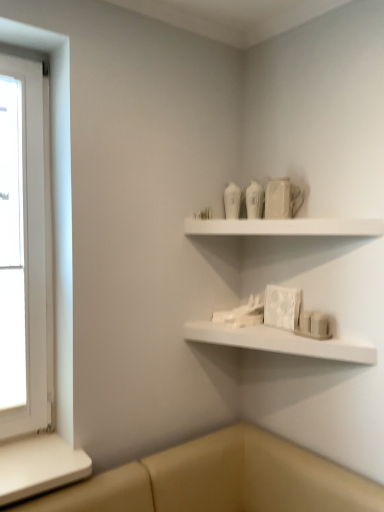
Measure the distance between white wooden window at left and camera.

white wooden window at left and camera are 1.50 meters apart from each other.

Identify the location of white matte shelf at upper center, the second shelf when ordered from bottom to top. This screenshot has height=512, width=384. (284, 227).

Based on the photo, from a real-world perspective, is white matte shelf at upper center, which ranks as the first shelf in top-to-bottom order, beneath white matte shelf at lower center, which is the 1th shelf in bottom-to-top order?

No, from a real-world perspective, white matte shelf at upper center, which ranks as the first shelf in top-to-bottom order, is not under white matte shelf at lower center, which is the 1th shelf in bottom-to-top order.

From the image's perspective, is white matte shelf at upper center, the second shelf when ordered from bottom to top, above or below white matte shelf at lower center, the 2th shelf viewed from the top?

white matte shelf at upper center, the second shelf when ordered from bottom to top, is situated higher than white matte shelf at lower center, the 2th shelf viewed from the top, in the image.

In the scene shown: Is white matte shelf at upper center, the second shelf when ordered from bottom to top, taller or shorter than white matte shelf at lower center, which is the 1th shelf in bottom-to-top order?

Considering their sizes, white matte shelf at upper center, the second shelf when ordered from bottom to top, has more height than white matte shelf at lower center, which is the 1th shelf in bottom-to-top order.

Can you tell me how much white matte shelf at lower center, which is the 1th shelf in bottom-to-top order, and white matte shelf at upper center, which ranks as the first shelf in top-to-bottom order, differ in facing direction?

The angle between the facing direction of white matte shelf at lower center, which is the 1th shelf in bottom-to-top order, and the facing direction of white matte shelf at upper center, which ranks as the first shelf in top-to-bottom order, is 1.91 degrees.

Relative to white matte shelf at upper center, which ranks as the first shelf in top-to-bottom order, is white matte shelf at lower center, which is the 1th shelf in bottom-to-top order, in front or behind?

white matte shelf at lower center, which is the 1th shelf in bottom-to-top order, is positioned farther from the viewer than white matte shelf at upper center, which ranks as the first shelf in top-to-bottom order.

Is white matte shelf at lower center, the 2th shelf viewed from the top, not near white matte shelf at upper center, which ranks as the first shelf in top-to-bottom order?

No, there isn't a large distance between white matte shelf at lower center, the 2th shelf viewed from the top, and white matte shelf at upper center, which ranks as the first shelf in top-to-bottom order.

Considering the positions of objects white wooden window at left and white matte shelf at lower center, the 2th shelf viewed from the top, in the image provided, who is in front, white wooden window at left or white matte shelf at lower center, the 2th shelf viewed from the top,?

white matte shelf at lower center, the 2th shelf viewed from the top.

From the image's perspective, is white wooden window at left on white matte shelf at lower center, which is the 1th shelf in bottom-to-top order?

Indeed, from the image's perspective, white wooden window at left is shown above white matte shelf at lower center, which is the 1th shelf in bottom-to-top order.

Considering the positions of objects white wooden window at left and white matte shelf at lower center, the 2th shelf viewed from the top, in the image provided, who is more to the left, white wooden window at left or white matte shelf at lower center, the 2th shelf viewed from the top,?

From the viewer's perspective, white wooden window at left appears more on the left side.

Who is bigger, white wooden window at left or white matte shelf at lower center, the 2th shelf viewed from the top?

With larger size is white wooden window at left.

Is white matte shelf at lower center, which is the 1th shelf in bottom-to-top order, in front of white wooden window at left?

Yes, white matte shelf at lower center, which is the 1th shelf in bottom-to-top order, is closer to the viewer.

Looking at the image, does white matte shelf at lower center, the 2th shelf viewed from the top, seem bigger or smaller compared to white wooden window at left?

white matte shelf at lower center, the 2th shelf viewed from the top, is smaller than white wooden window at left.

What's the angular difference between white matte shelf at lower center, which is the 1th shelf in bottom-to-top order, and white wooden window at left's facing directions?

The angle between the facing direction of white matte shelf at lower center, which is the 1th shelf in bottom-to-top order, and the facing direction of white wooden window at left is 89.8 degrees.

Who is taller, white matte shelf at lower center, the 2th shelf viewed from the top, or white wooden window at left?

Standing taller between the two is white wooden window at left.

Considering the sizes of objects white wooden window at left and white matte shelf at upper center, the second shelf when ordered from bottom to top, in the image provided, who is bigger, white wooden window at left or white matte shelf at upper center, the second shelf when ordered from bottom to top,?

Bigger between the two is white wooden window at left.

Considering the sizes of objects white wooden window at left and white matte shelf at upper center, which ranks as the first shelf in top-to-bottom order, in the image provided, who is wider, white wooden window at left or white matte shelf at upper center, which ranks as the first shelf in top-to-bottom order,?

With larger width is white matte shelf at upper center, which ranks as the first shelf in top-to-bottom order.

How different are the orientations of white wooden window at left and white matte shelf at upper center, which ranks as the first shelf in top-to-bottom order, in degrees?

87.9 degrees separate the facing orientations of white wooden window at left and white matte shelf at upper center, which ranks as the first shelf in top-to-bottom order.

Are white matte shelf at upper center, which ranks as the first shelf in top-to-bottom order, and white wooden window at left making contact?

white matte shelf at upper center, which ranks as the first shelf in top-to-bottom order, is not next to white wooden window at left, and they're not touching.

The width and height of the screenshot is (384, 512). In order to click on shelf above the white wooden window at left (from the image's perspective) in this screenshot , I will do (284, 227).

Based on their sizes in the image, would you say white matte shelf at upper center, which ranks as the first shelf in top-to-bottom order, is bigger or smaller than white wooden window at left?

Clearly, white matte shelf at upper center, which ranks as the first shelf in top-to-bottom order, is smaller in size than white wooden window at left.

Can you tell me how much white matte shelf at upper center, the second shelf when ordered from bottom to top, and white wooden window at left differ in facing direction?

white matte shelf at upper center, the second shelf when ordered from bottom to top, and white wooden window at left are facing 87.9 degrees away from each other.

The height and width of the screenshot is (512, 384). Find the location of `shelf lying in front of the white matte shelf at lower center, which is the 1th shelf in bottom-to-top order`. shelf lying in front of the white matte shelf at lower center, which is the 1th shelf in bottom-to-top order is located at coordinates (284, 227).

Where is `shelf on the right of white matte shelf at lower center, which is the 1th shelf in bottom-to-top order`? The image size is (384, 512). shelf on the right of white matte shelf at lower center, which is the 1th shelf in bottom-to-top order is located at coordinates pos(284,227).

Which object lies nearer to the anchor point white matte shelf at lower center, which is the 1th shelf in bottom-to-top order, white matte shelf at upper center, the second shelf when ordered from bottom to top, or white wooden window at left?

white matte shelf at upper center, the second shelf when ordered from bottom to top, is closer to white matte shelf at lower center, which is the 1th shelf in bottom-to-top order.

Which object lies further to the anchor point white wooden window at left, white matte shelf at lower center, which is the 1th shelf in bottom-to-top order, or white matte shelf at upper center, the second shelf when ordered from bottom to top?

white matte shelf at lower center, which is the 1th shelf in bottom-to-top order, is positioned further to the anchor white wooden window at left.

Considering their positions, is white wooden window at left positioned further to white matte shelf at upper center, which ranks as the first shelf in top-to-bottom order, than white matte shelf at lower center, which is the 1th shelf in bottom-to-top order?

Among the two, white wooden window at left is located further to white matte shelf at upper center, which ranks as the first shelf in top-to-bottom order.

Estimate the real-world distances between objects in this image. Which object is closer to white wooden window at left, white matte shelf at upper center, the second shelf when ordered from bottom to top, or white matte shelf at lower center, the 2th shelf viewed from the top?

Based on the image, white matte shelf at upper center, the second shelf when ordered from bottom to top, appears to be nearer to white wooden window at left.

Which object lies nearer to the anchor point white matte shelf at lower center, the 2th shelf viewed from the top, white wooden window at left or white matte shelf at upper center, the second shelf when ordered from bottom to top?

The object closer to white matte shelf at lower center, the 2th shelf viewed from the top, is white matte shelf at upper center, the second shelf when ordered from bottom to top.

Considering their positions, is white matte shelf at lower center, the 2th shelf viewed from the top, positioned further to white matte shelf at upper center, the second shelf when ordered from bottom to top, than white wooden window at left?

white wooden window at left is positioned further to the anchor white matte shelf at upper center, the second shelf when ordered from bottom to top.

Find the location of a particular element. This screenshot has width=384, height=512. shelf situated between white wooden window at left and white matte shelf at upper center, which ranks as the first shelf in top-to-bottom order, from left to right is located at coordinates (281, 341).